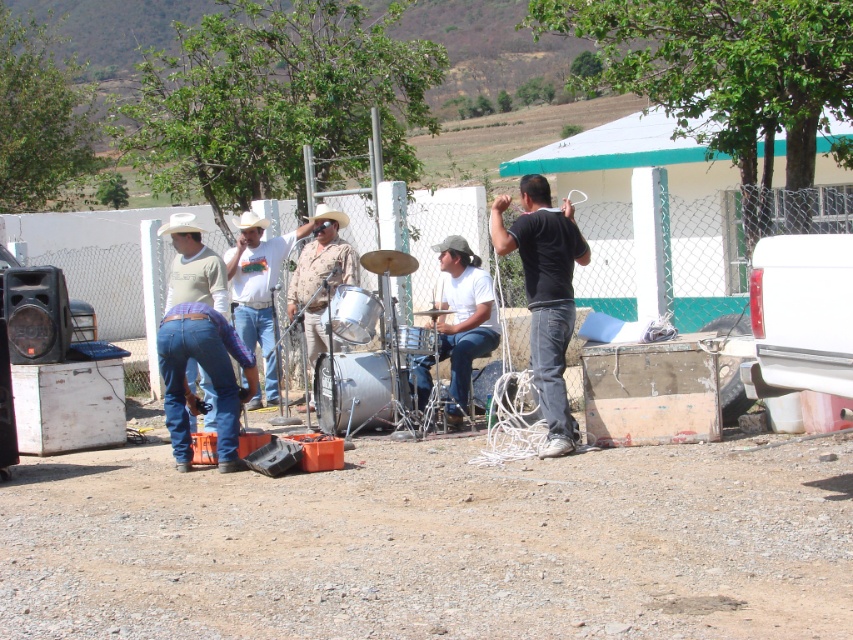
Question: Does black matte shirt at center have a greater width compared to white cotton shirt at center?

Choices:
 (A) no
 (B) yes

Answer: (A)

Question: Which object appears closest to the camera in this image?

Choices:
 (A) camouflage shirt at center
 (B) white matte drum at center
 (C) black matte shirt at center
 (D) white cotton shirt at center

Answer: (C)

Question: Which point appears closest to the camera in this image?

Choices:
 (A) click(271, 326)
 (B) click(303, 294)

Answer: (B)

Question: Which point is farther to the camera?

Choices:
 (A) (538, 376)
 (B) (474, 355)
 (C) (263, 346)

Answer: (C)

Question: Is white matte drum at center to the left of white cotton shirt at center from the viewer's perspective?

Choices:
 (A) no
 (B) yes

Answer: (A)

Question: Is black matte shirt at center below white matte drum at center?

Choices:
 (A) yes
 (B) no

Answer: (B)